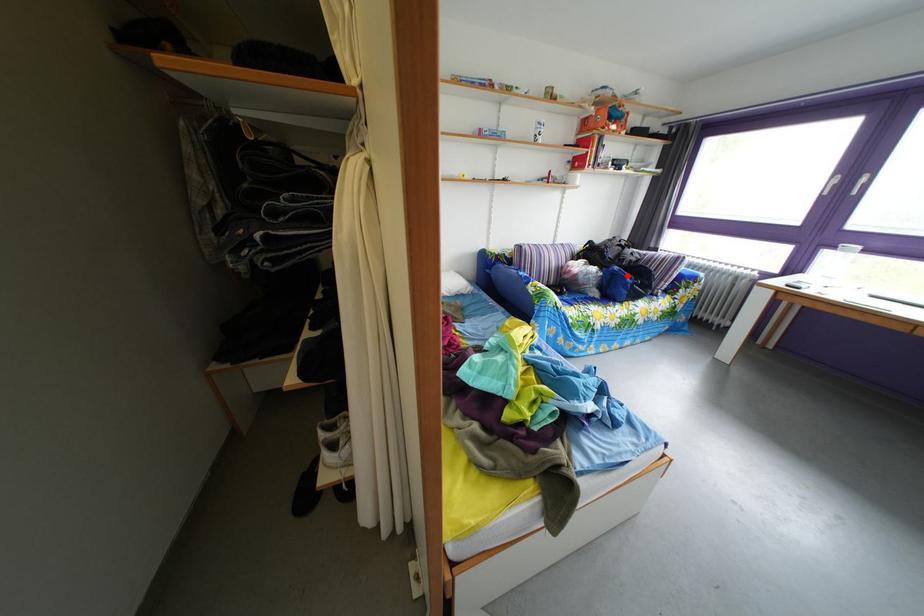
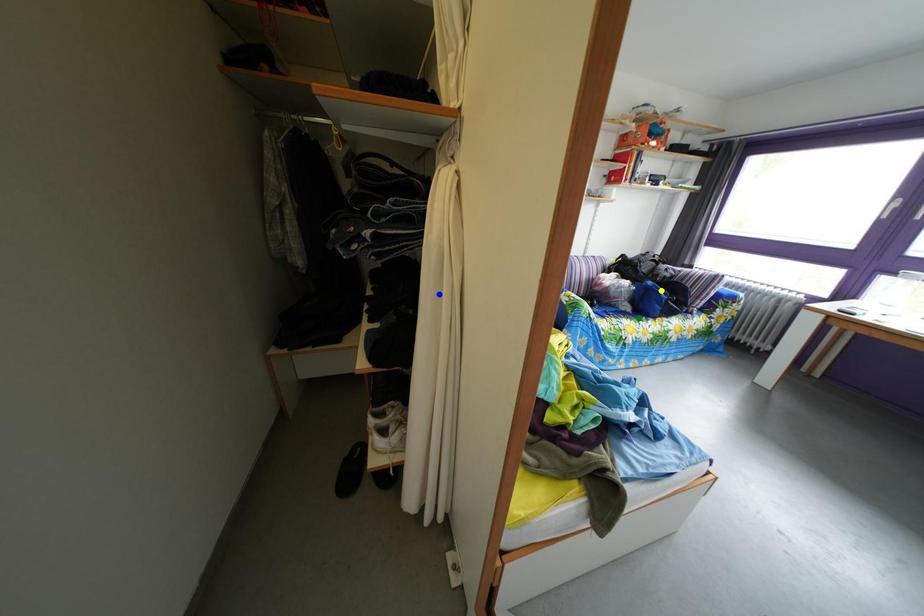
Question: I am providing you with two images of the same scene from different viewpoints. A red point is marked on the first image. You are given multiple points on the second image. Can you choose the point in image 2 that corresponds to the point in image 1?

Choices:
 (A) yellow point
 (B) blue point
 (C) green point

Answer: (A)